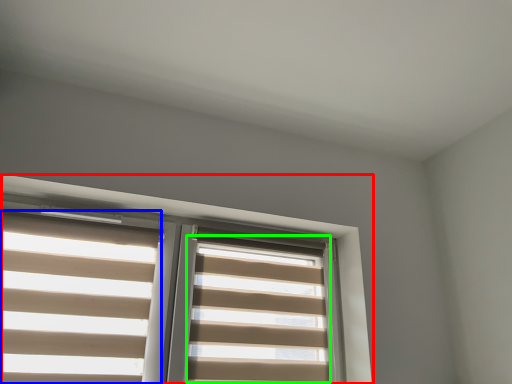
Question: Which object is positioned farthest from window (highlighted by a red box)? Select from blind (highlighted by a blue box) and blind (highlighted by a green box).

Choices:
 (A) blind
 (B) blind

Answer: (A)